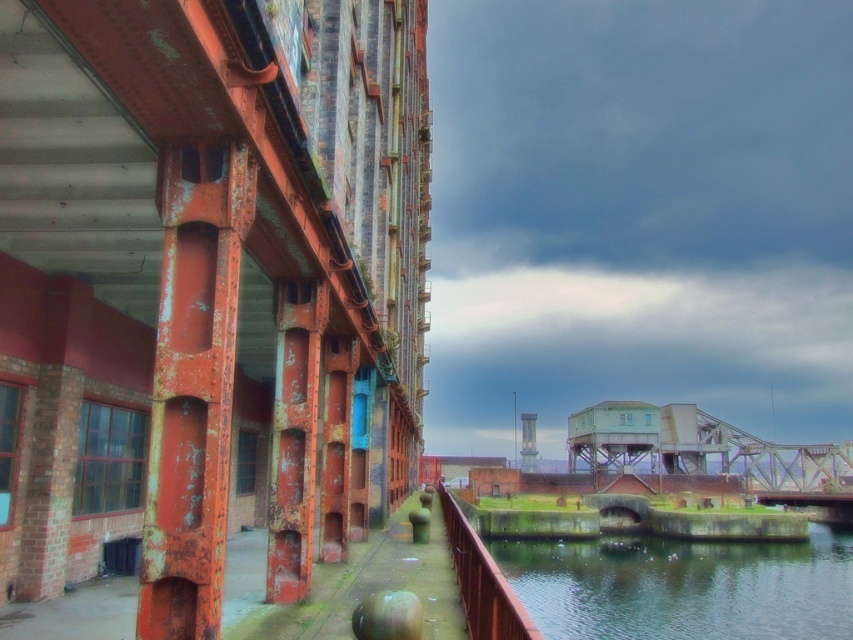
You are standing on the concrete walkway near the large weathered brick building. You want to cross to the other side of the clear water at lower right. Is the rustic metal bridge at center a viable path for you to use?

The clear water at lower right is in front of the rustic metal bridge at center, meaning the bridge is between you and the water. Therefore, the rustic metal bridge at center is a viable path to cross to the other side of the clear water at lower right.

You are a maintenance worker inspecting the walkway. You notice the clear water at lower right and the rusty metal rail at lower center. Which object has a greater width?

The clear water at lower right has a greater width than the rusty metal rail at lower center according to the description.